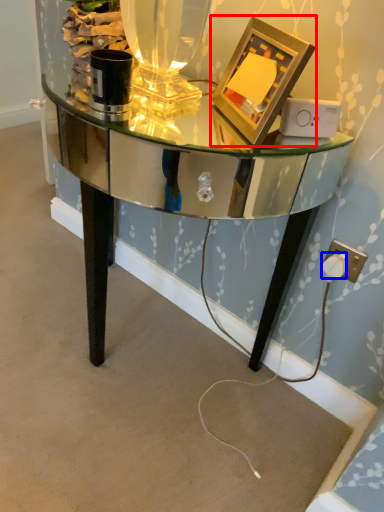
Question: Among these objects, which one is nearest to the camera, picture frame (highlighted by a red box) or plug (highlighted by a blue box)?

Choices:
 (A) picture frame
 (B) plug

Answer: (A)